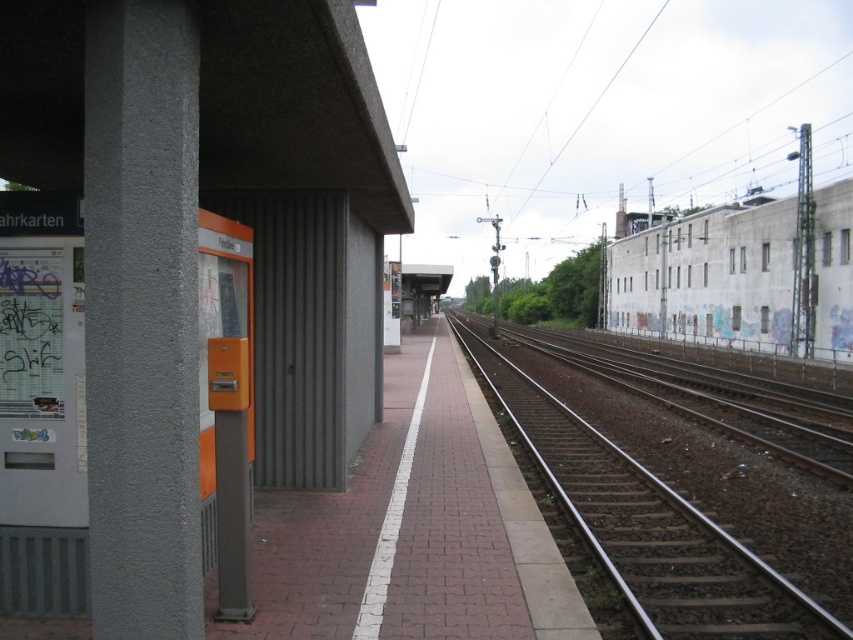
Is orange plastic vending machine at left smaller than brown gravel track at right?

Indeed, orange plastic vending machine at left has a smaller size compared to brown gravel track at right.

Is point (170, 420) positioned after point (648, 506)?

That is False.

At what (x,y) coordinates should I click in order to perform the action: click on orange plastic vending machine at left. Please return your answer as a coordinate pair (x, y). Looking at the image, I should click on (303, 147).

Consider the image. Between gray concrete pillar at left and brown gravel track at right, which one appears on the right side from the viewer's perspective?

brown gravel track at right

Is gray concrete pillar at left taller than brown gravel track at right?

Indeed, gray concrete pillar at left has a greater height compared to brown gravel track at right.

Measure the distance between point [160,572] and camera.

3.14 meters

Locate an element on the screen. Image resolution: width=853 pixels, height=640 pixels. gray concrete pillar at left is located at coordinates (142, 317).

Between orange plastic vending machine at left and gray concrete pillar at left, which one is positioned higher?

orange plastic vending machine at left is higher up.

Can you confirm if orange plastic vending machine at left is smaller than gray concrete pillar at left?

Yes.

Who is more forward, (251, 56) or (157, 484)?

Point (157, 484)

Locate an element on the screen. The image size is (853, 640). orange plastic vending machine at left is located at coordinates (303, 147).